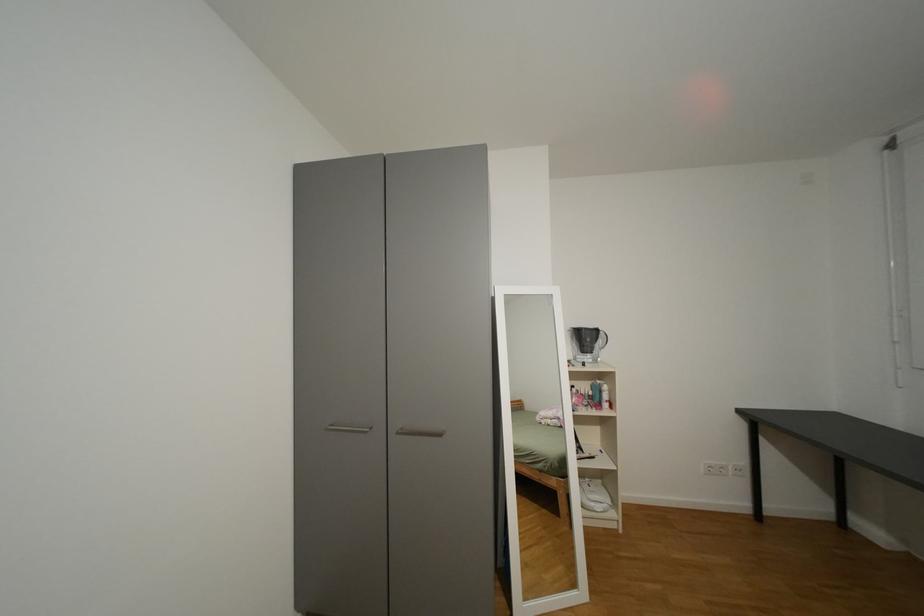
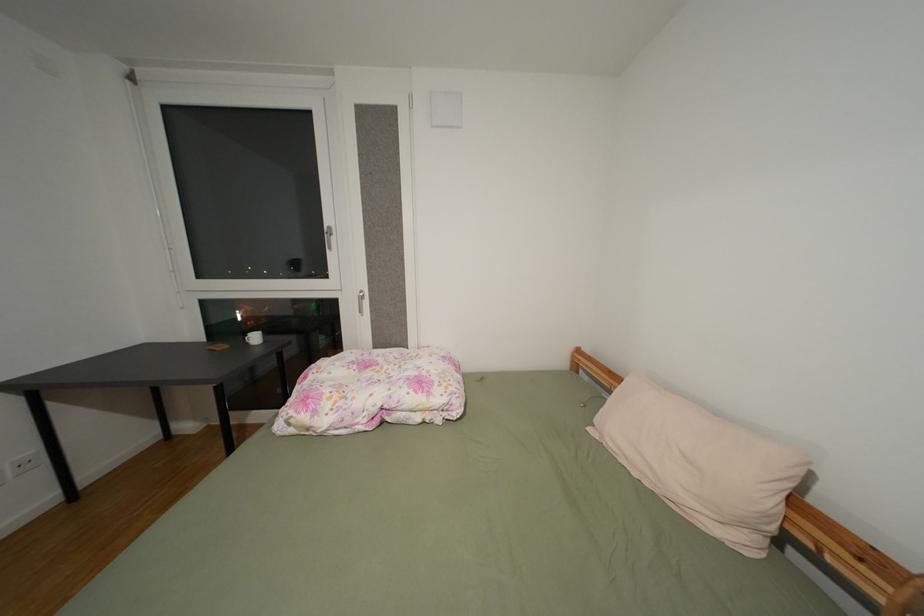
Question: The camera is either moving clockwise (left) or counter-clockwise (right) around the object. The first image is from the beginning of the video and the second image is from the end. Is the camera moving left or right when shooting the video?

Choices:
 (A) Left
 (B) Right

Answer: (A)